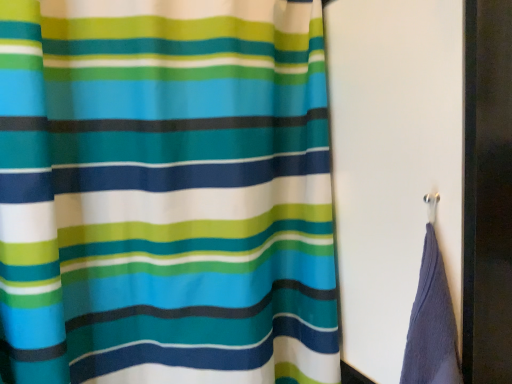
Where is `metallic hook at right`? The height and width of the screenshot is (384, 512). metallic hook at right is located at coordinates (393, 164).

This screenshot has width=512, height=384. What do you see at coordinates (393, 164) in the screenshot?
I see `metallic hook at right` at bounding box center [393, 164].

This screenshot has width=512, height=384. Find the location of `matte fabric curtain at upper right`. matte fabric curtain at upper right is located at coordinates (165, 193).

Describe the element at coordinates (165, 193) in the screenshot. I see `matte fabric curtain at upper right` at that location.

Identify the location of metallic hook at right. (393, 164).

Considering the positions of objects matte fabric curtain at upper right and metallic hook at right in the image provided, who is more to the right, matte fabric curtain at upper right or metallic hook at right?

metallic hook at right is more to the right.

Considering the relative positions of matte fabric curtain at upper right and metallic hook at right in the image provided, is matte fabric curtain at upper right in front of metallic hook at right?

Yes, it is in front of metallic hook at right.

Which is in front, point (108, 41) or point (387, 195)?

Positioned in front is point (108, 41).

From the image's perspective, which one is positioned lower, matte fabric curtain at upper right or metallic hook at right?

matte fabric curtain at upper right, from the image's perspective.

From a real-world perspective, between matte fabric curtain at upper right and metallic hook at right, who is vertically higher?

metallic hook at right.

Does matte fabric curtain at upper right have a greater width compared to metallic hook at right?

No.

Who is taller, matte fabric curtain at upper right or metallic hook at right?

matte fabric curtain at upper right.

Considering the sizes of objects matte fabric curtain at upper right and metallic hook at right in the image provided, who is smaller, matte fabric curtain at upper right or metallic hook at right?

metallic hook at right is smaller.

Is metallic hook at right a part of matte fabric curtain at upper right?

Actually, metallic hook at right is outside matte fabric curtain at upper right.

Would you say matte fabric curtain at upper right is a long distance from metallic hook at right?

No, there isn't a large distance between matte fabric curtain at upper right and metallic hook at right.

Is matte fabric curtain at upper right facing towards metallic hook at right?

Yes, matte fabric curtain at upper right is facing metallic hook at right.

How many degrees apart are the facing directions of matte fabric curtain at upper right and metallic hook at right?

The facing directions of matte fabric curtain at upper right and metallic hook at right are 90.6 degrees apart.

Measure the distance from matte fabric curtain at upper right to metallic hook at right.

The distance of matte fabric curtain at upper right from metallic hook at right is 8.67 inches.

Locate an element on the screen. curtain below the metallic hook at right (from a real-world perspective) is located at coordinates (165, 193).

Can you confirm if metallic hook at right is positioned to the right of matte fabric curtain at upper right?

Yes, metallic hook at right is to the right of matte fabric curtain at upper right.

Considering the positions of objects metallic hook at right and matte fabric curtain at upper right in the image provided, who is behind, metallic hook at right or matte fabric curtain at upper right?

metallic hook at right is further from the camera.

Does point (361, 315) come farther from viewer compared to point (61, 172)?

Yes, it is behind point (61, 172).

From the image's perspective, is metallic hook at right positioned above or below matte fabric curtain at upper right?

metallic hook at right is above matte fabric curtain at upper right.

Looking at this image, from a real-world perspective, which object rests below the other?

In real-world perspective, matte fabric curtain at upper right is lower.

Which object is thinner, metallic hook at right or matte fabric curtain at upper right?

matte fabric curtain at upper right is thinner.

Is metallic hook at right taller than matte fabric curtain at upper right?

In fact, metallic hook at right may be shorter than matte fabric curtain at upper right.

Is metallic hook at right bigger or smaller than matte fabric curtain at upper right?

In the image, metallic hook at right appears to be smaller than matte fabric curtain at upper right.

Is metallic hook at right positioned beyond the bounds of matte fabric curtain at upper right?

Yes, metallic hook at right is outside of matte fabric curtain at upper right.

Can you see metallic hook at right touching matte fabric curtain at upper right?

No, metallic hook at right is not in contact with matte fabric curtain at upper right.

Does metallic hook at right turn towards matte fabric curtain at upper right?

Yes, metallic hook at right faces towards matte fabric curtain at upper right.

Can you tell me how much metallic hook at right and matte fabric curtain at upper right differ in facing direction?

The angular difference between metallic hook at right and matte fabric curtain at upper right is 90.6 degrees.

You are a GUI agent. You are given a task and a screenshot of the screen. Output one action in this format:
    pyautogui.click(x=<x>, y=<y>)
    Task: Click on the curtain located underneath the metallic hook at right (from a real-world perspective)
    Image resolution: width=512 pixels, height=384 pixels.
    Given the screenshot: What is the action you would take?
    pyautogui.click(x=165, y=193)

You are a GUI agent. You are given a task and a screenshot of the screen. Output one action in this format:
    pyautogui.click(x=<x>, y=<y>)
    Task: Click on the screen door on the right side of matte fabric curtain at upper right
    The height and width of the screenshot is (384, 512).
    Given the screenshot: What is the action you would take?
    pyautogui.click(x=393, y=164)

You are a GUI agent. You are given a task and a screenshot of the screen. Output one action in this format:
    pyautogui.click(x=<x>, y=<y>)
    Task: Click on the screen door located behind the matte fabric curtain at upper right
    The height and width of the screenshot is (384, 512).
    Given the screenshot: What is the action you would take?
    393,164